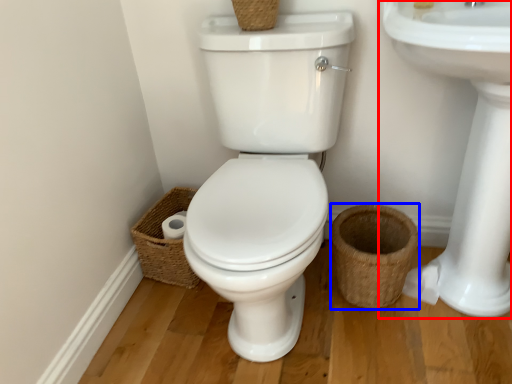
Question: Among these objects, which one is nearest to the camera, sink (highlighted by a red box) or basket (highlighted by a blue box)?

Choices:
 (A) sink
 (B) basket

Answer: (A)